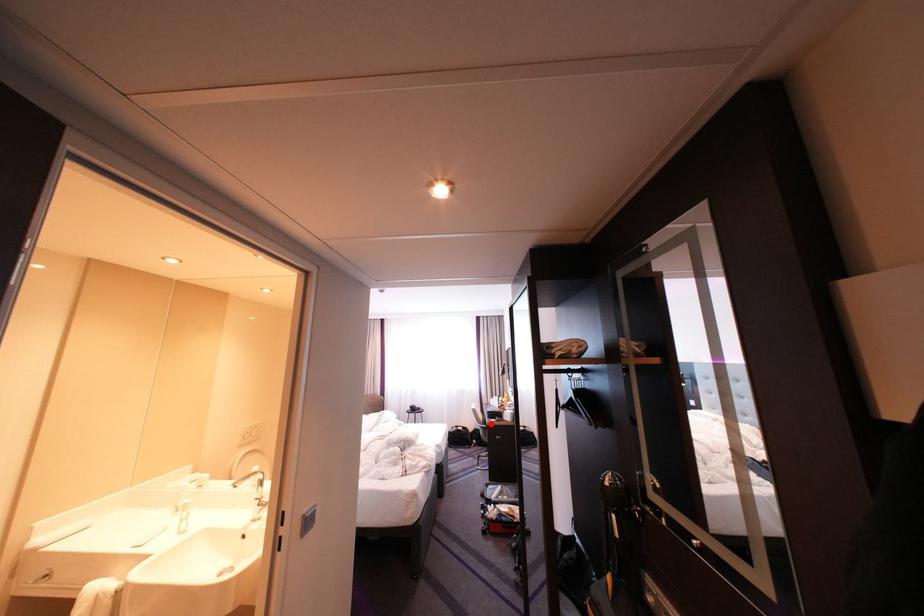
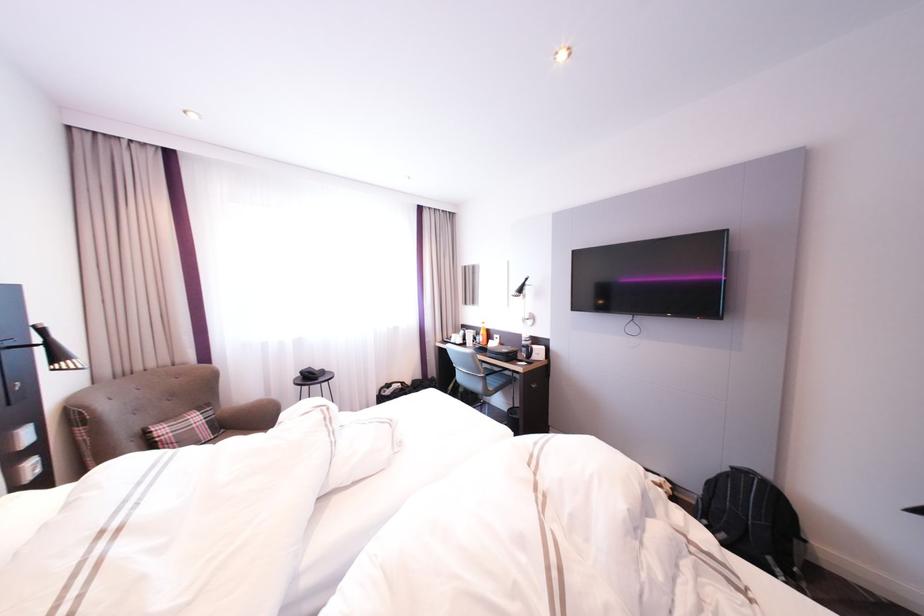
Question: I am providing you with two images of the same scene from different viewpoints. Image1 has a red point marked. In image2, the corresponding 3D location appears at what relative position? Reply with the corresponding letter.

Choices:
 (A) Closer
 (B) Farther

Answer: (A)